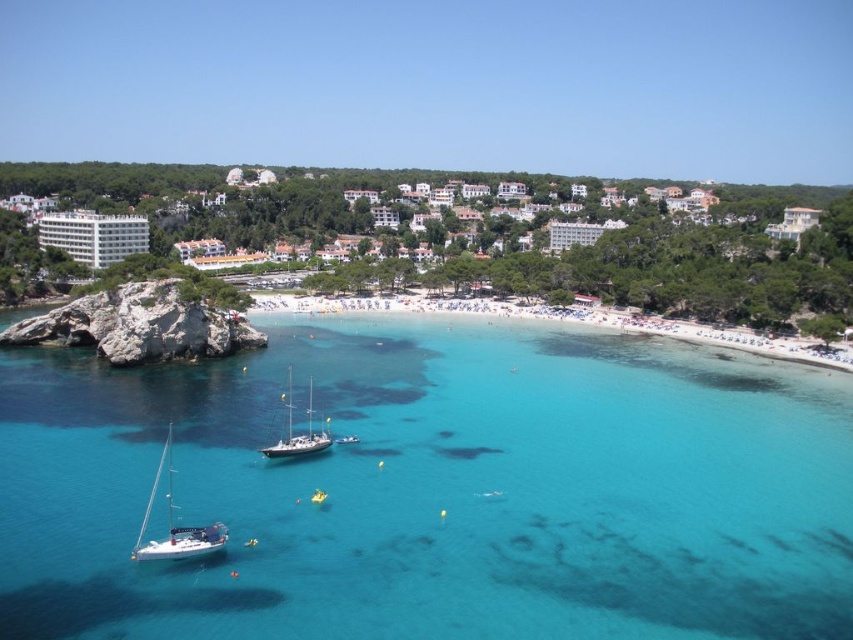
You are a photographer planning to take a photo of the white glossy sailboat at lower left and the white glossy sailboat at center. From your current position, which boat appears closer to the bottom of the photo?

The white glossy sailboat at lower left appears closer to the bottom of the photo because it is positioned under the white glossy sailboat at center.